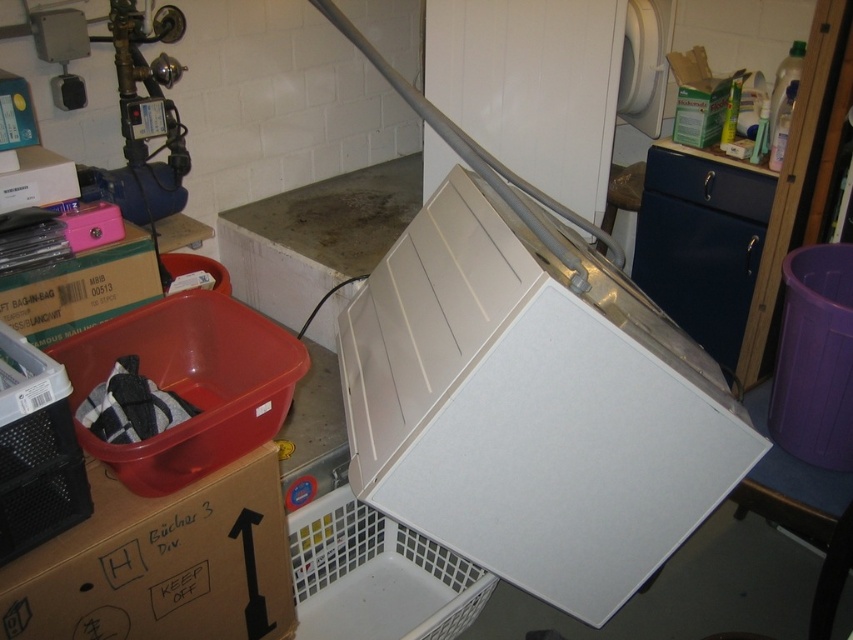
In the scene shown: Who is higher up, white plastic basket at lower center or matte cardboard box at left?

matte cardboard box at left is above.

What do you see at coordinates (376, 577) in the screenshot? I see `white plastic basket at lower center` at bounding box center [376, 577].

Is point (311, 586) closer to viewer compared to point (68, 294)?

No.

Locate an element on the screen. white plastic basket at lower center is located at coordinates (376, 577).

Image resolution: width=853 pixels, height=640 pixels. What do you see at coordinates (80, 289) in the screenshot?
I see `matte cardboard box at left` at bounding box center [80, 289].

Is matte cardboard box at left shorter than white cardboard box at upper left?

No.

Which is in front, point (83, 266) or point (53, 168)?

Point (53, 168)

Identify the location of matte cardboard box at left. This screenshot has width=853, height=640. (80, 289).

Measure the distance from white plastic basket at lower center to white cardboard box at upper left.

3.51 feet

Does white plastic basket at lower center have a greater height compared to white cardboard box at upper left?

Yes.

This screenshot has height=640, width=853. I want to click on white plastic basket at lower center, so click(x=376, y=577).